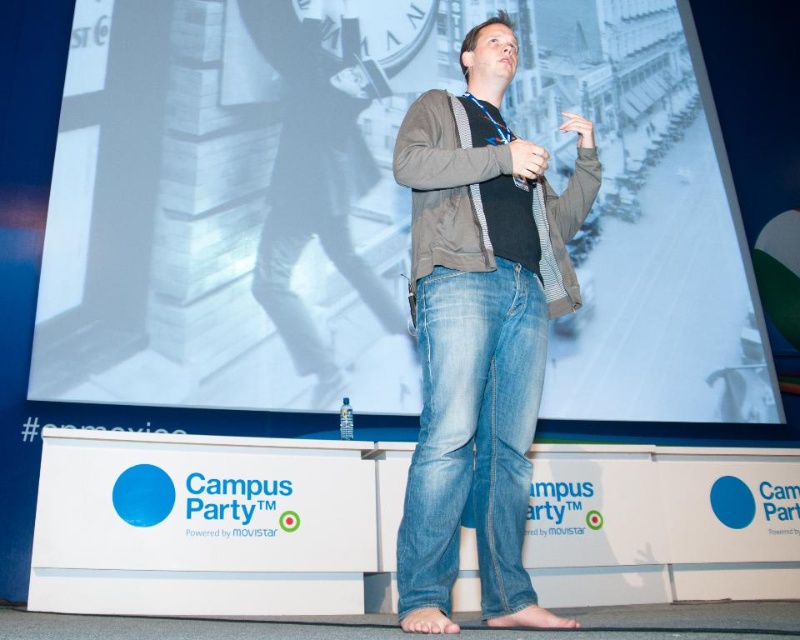
Who is higher up, white matte projection screen at upper center or denim jeans at center?

white matte projection screen at upper center

Which is in front, point (397, 22) or point (502, 300)?

Point (502, 300) is in front.

Where is `white matte projection screen at upper center`? This screenshot has height=640, width=800. white matte projection screen at upper center is located at coordinates (374, 208).

Locate an element on the screen. The image size is (800, 640). white matte projection screen at upper center is located at coordinates (374, 208).